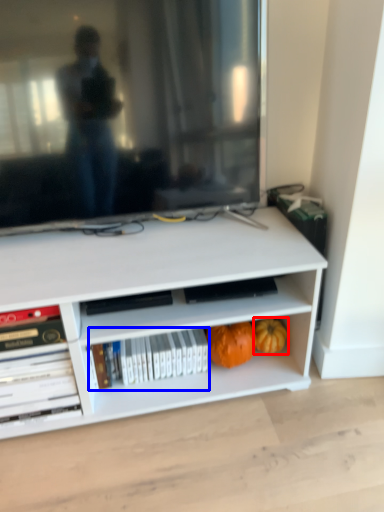
Question: Which object is further to the camera taking this photo, pumpkin (highlighted by a red box) or book (highlighted by a blue box)?

Choices:
 (A) pumpkin
 (B) book

Answer: (A)